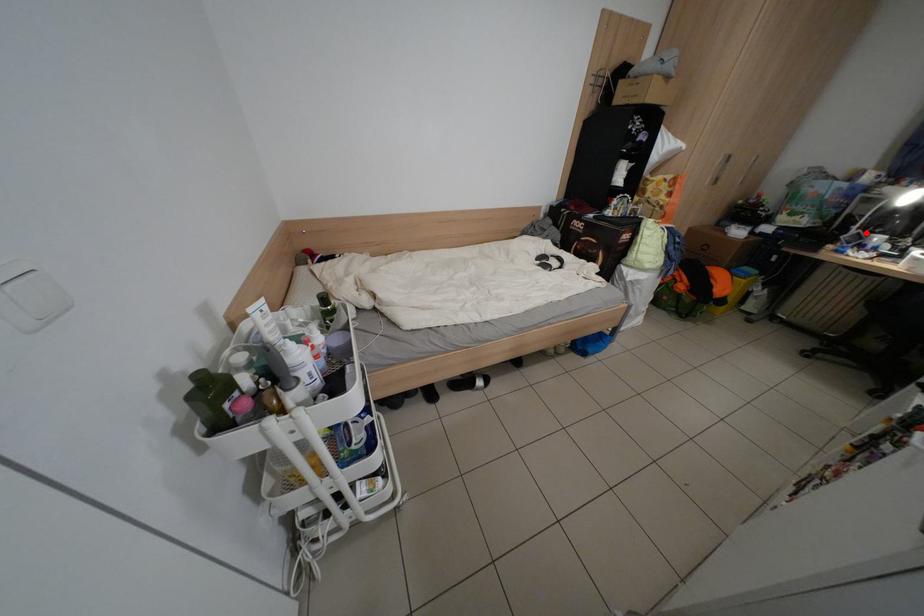
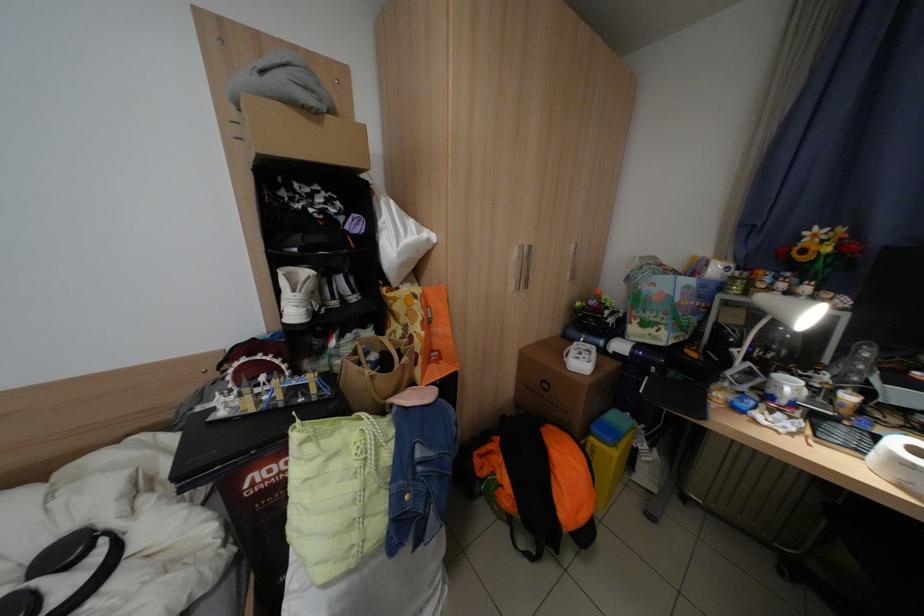
Question: I am providing you with two images of the same scene from different viewpoints. A red point is shown in image1. For the corresponding object point in image2, is it positioned nearer or farther from the camera?

Choices:
 (A) Nearer
 (B) Farther

Answer: (A)